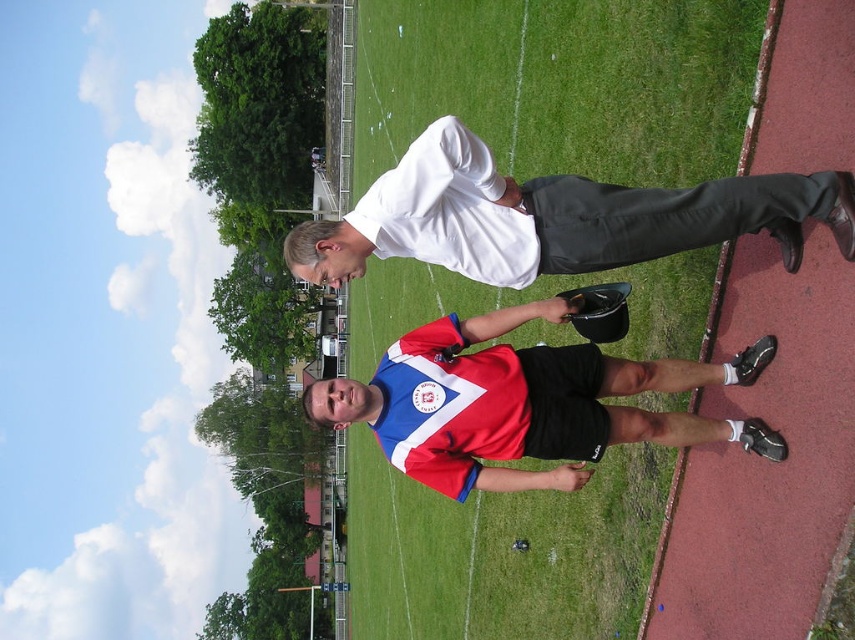
You are a referee standing at the edge of the football pitch. You need to retrieve the red and white jersey at center from the player who is 24.98 meters away. Can you walk directly to them without crossing the halfway line?

The red and white jersey at center is 24.98 meters away. Since the halfway line is typically 45 meters from each goal line in a standard football pitch, you can walk directly to them without crossing the halfway line as the distance is less than half the pitch length.

You are a photographer trying to capture a photo of the green grass at center and the white matte shirt at upper center. Which object should you focus on first if you want to ensure both are in focus without adjusting the camera settings?

To ensure both the green grass at center and the white matte shirt at upper center are in focus, you should focus on the white matte shirt at upper center first since it is closer to the viewer than the green grass at center, allowing the depth of field to extend backward to include the grass.